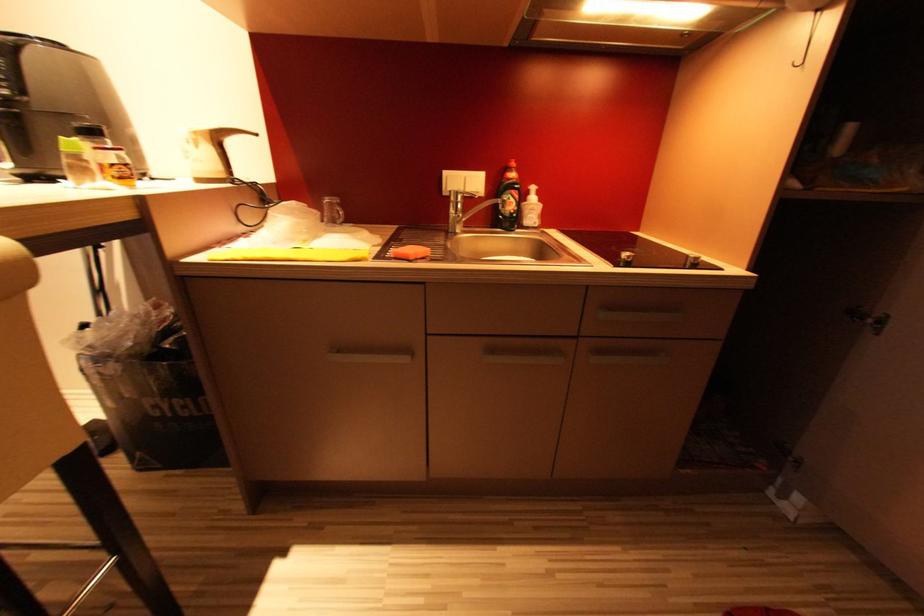
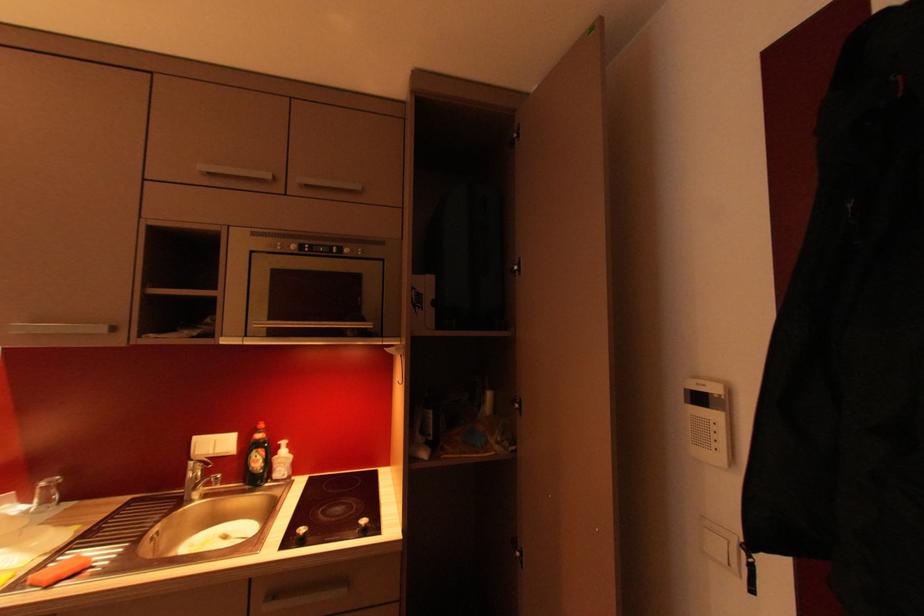
In the scene shown: How did the camera likely rotate?

The camera rotated toward right-up.